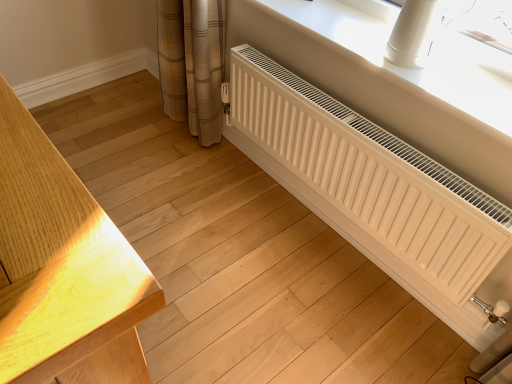
Identify the location of empty space that is ontop of white plastic radiator at lower right (from a real-world perspective). (376, 33).